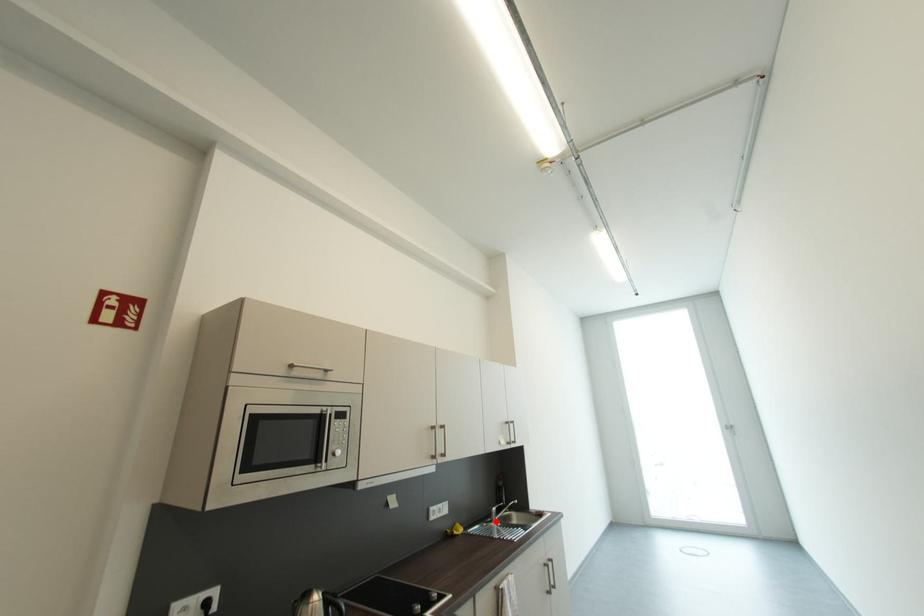
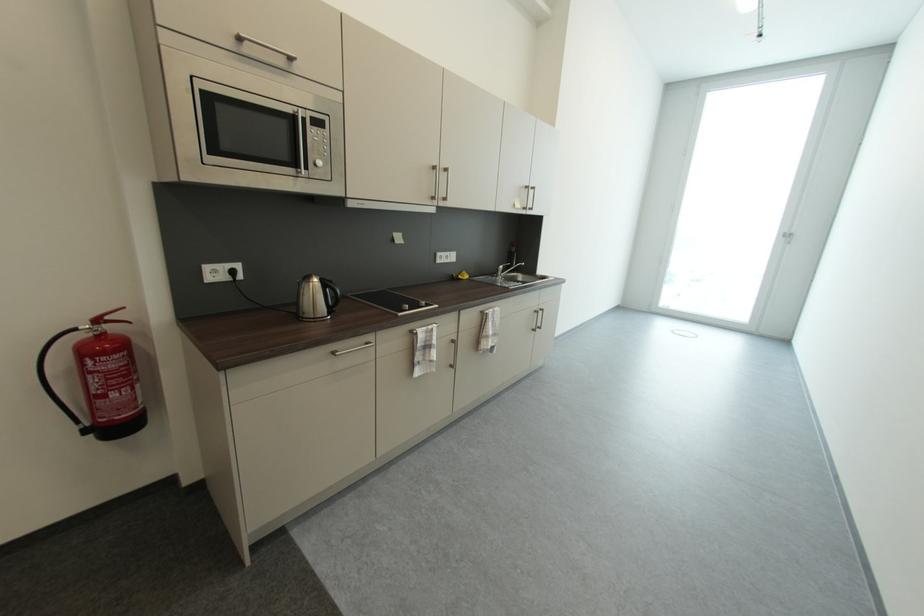
In the second image, find the point that corresponds to the highlighted location in the first image.

(502, 277)